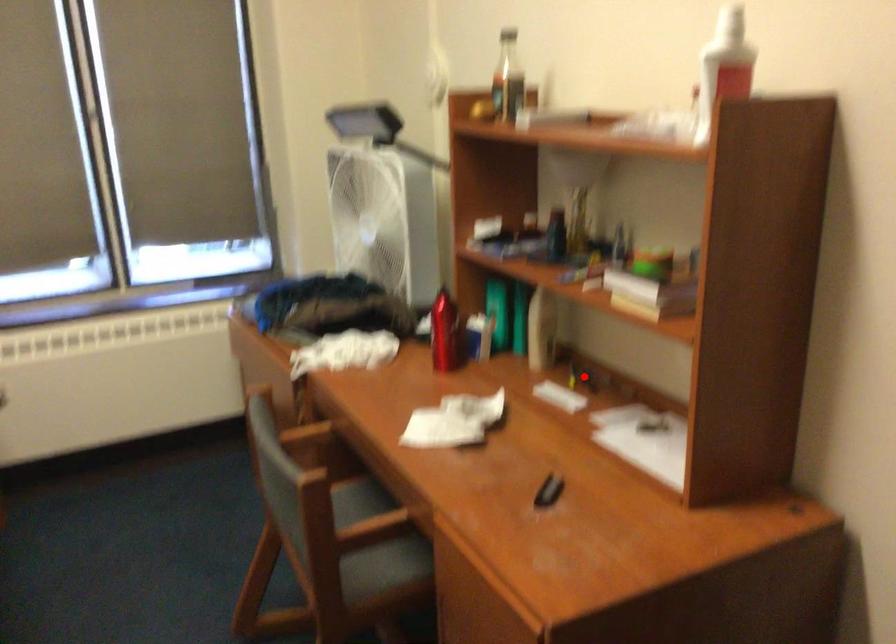
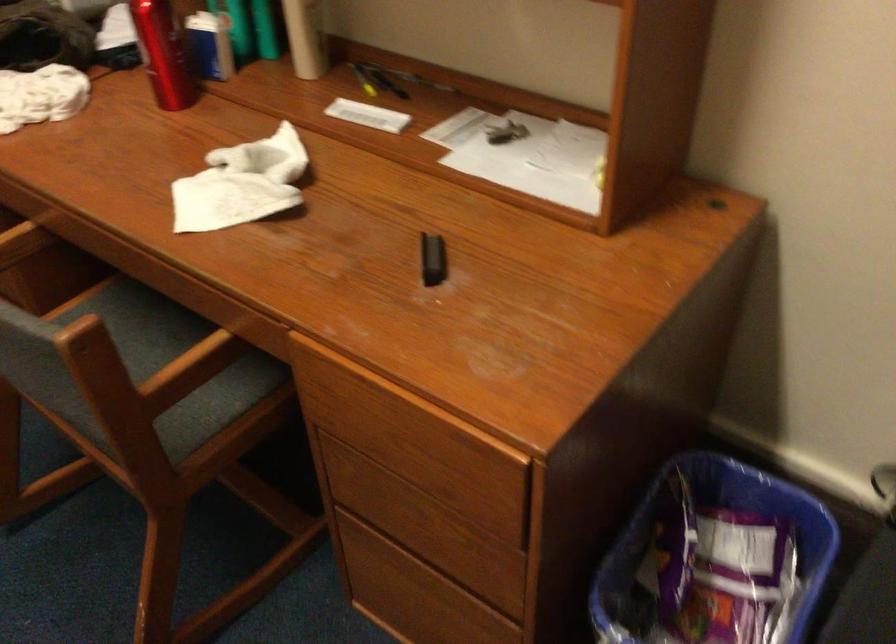
Question: I am providing you with two images of the same scene from different viewpoints. A red point is marked on the first image. Is the red point's position out of view in image 2?

Choices:
 (A) Yes
 (B) No

Answer: (B)